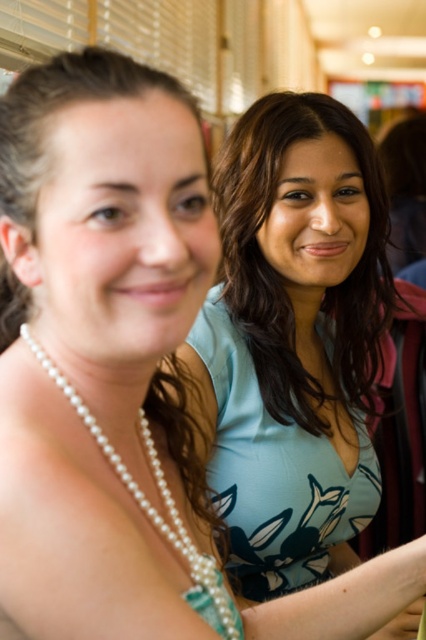
Question: Does pearl necklace at left have a lesser width compared to pearl necklace at center?

Choices:
 (A) no
 (B) yes

Answer: (A)

Question: In this image, where is matte blue blouse at center located relative to pearl necklace at left?

Choices:
 (A) below
 (B) above

Answer: (B)

Question: Which of the following is the closest to the observer?

Choices:
 (A) pearl necklace at left
 (B) matte blue blouse at center

Answer: (A)

Question: Is matte blue blouse at center positioned in front of pearl necklace at center?

Choices:
 (A) yes
 (B) no

Answer: (B)

Question: Which point is farther to the camera?

Choices:
 (A) pearl necklace at center
 (B) matte blue blouse at center
 (C) pearl necklace at left

Answer: (B)

Question: Among these objects, which one is nearest to the camera?

Choices:
 (A) pearl necklace at center
 (B) pearl necklace at left

Answer: (B)